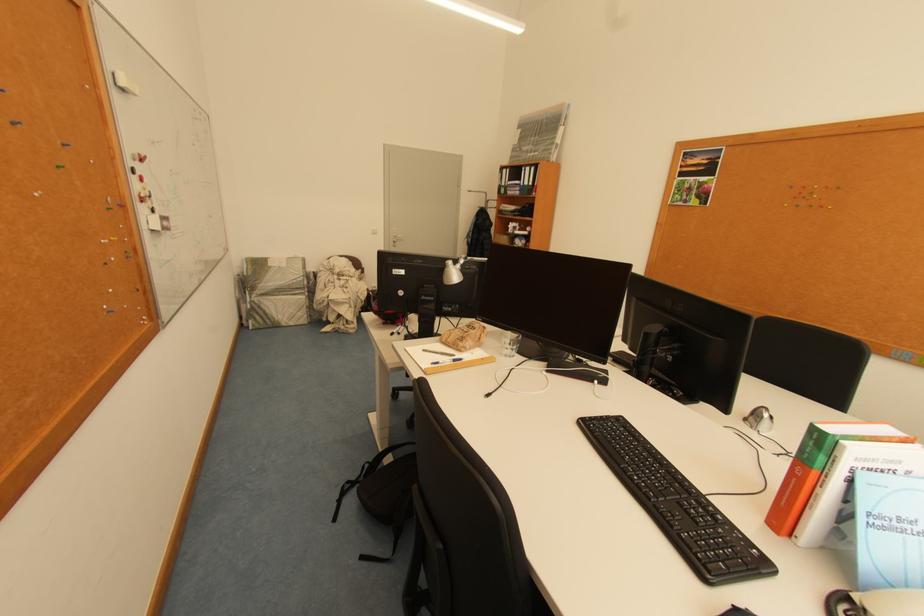
Locate an element on the screen. This screenshot has height=616, width=924. whiteboard eraser is located at coordinates (124, 83).